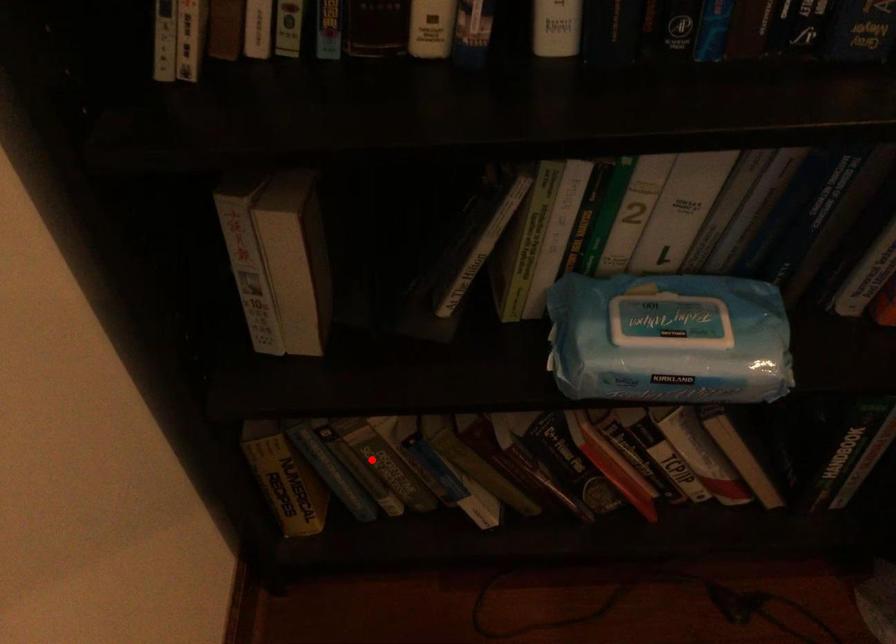
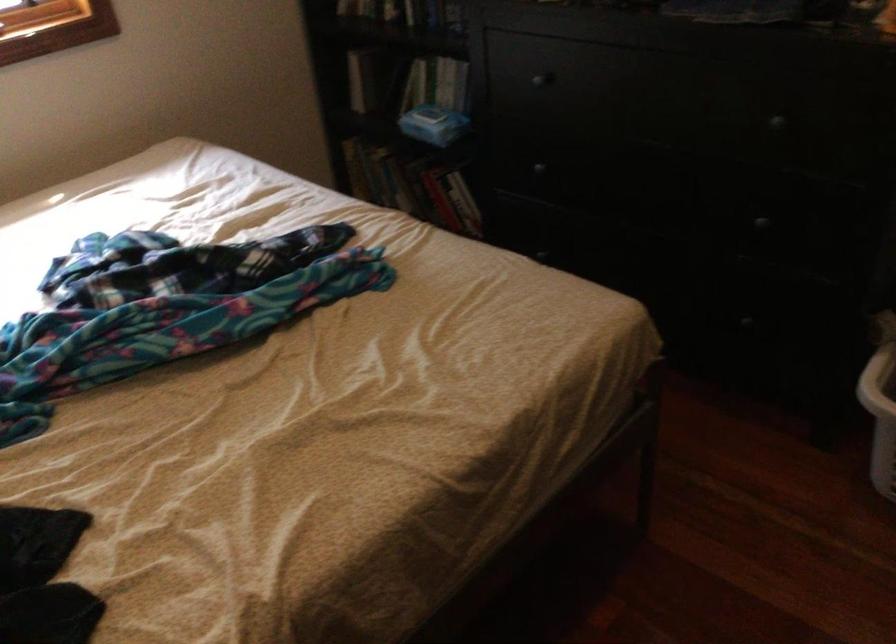
Question: I am providing you with two images of the same scene from different viewpoints. A red point is shown in image1. For the corresponding object point in image2, is it positioned nearer or farther from the camera?

Choices:
 (A) Nearer
 (B) Farther

Answer: (B)